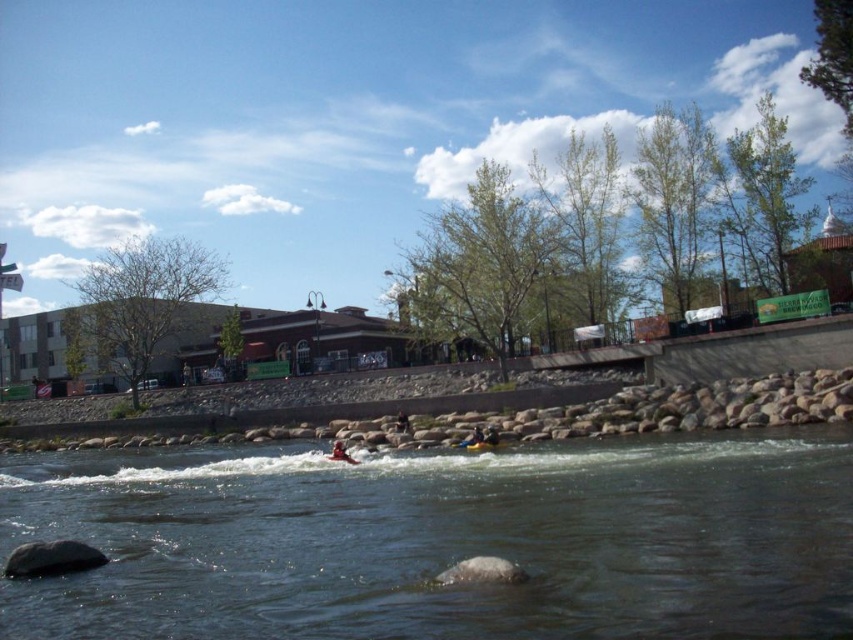
Between yellow rubber boat at center and dark blue fabric kayak at center, which one has less height?

dark blue fabric kayak at center is shorter.

Who is higher up, yellow rubber boat at center or dark blue fabric kayak at center?

dark blue fabric kayak at center is above.

Locate an element on the screen. This screenshot has width=853, height=640. yellow rubber boat at center is located at coordinates (485, 445).

Does orange life jacket at center have a greater width compared to yellow life jacket at center?

Indeed, orange life jacket at center has a greater width compared to yellow life jacket at center.

Which is more to the right, orange life jacket at center or yellow life jacket at center?

Positioned to the right is yellow life jacket at center.

Is point (332, 451) behind point (483, 432)?

Yes, it is behind point (483, 432).

What are the coordinates of `orange life jacket at center` in the screenshot? It's located at click(340, 452).

Which is more to the right, yellow rubber boat at center or yellow life jacket at center?

yellow life jacket at center

Can you confirm if yellow rubber boat at center is positioned above yellow life jacket at center?

Incorrect, yellow rubber boat at center is not positioned above yellow life jacket at center.

Which is behind, point (479, 442) or point (497, 442)?

Point (497, 442)

Find the location of a particular element. yellow rubber boat at center is located at coordinates click(485, 445).